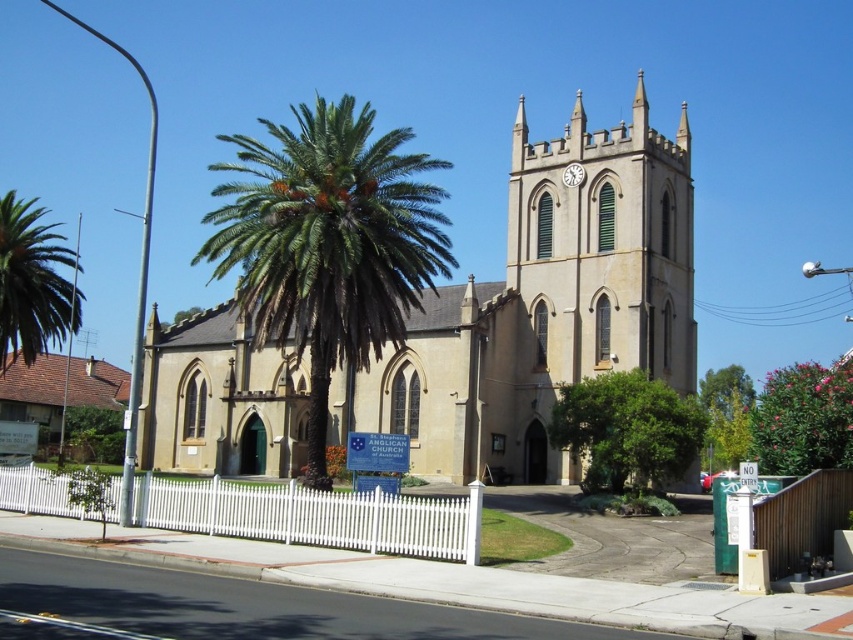
From the picture: You are standing in front of the church and want to place a 10 meter long banner between the beige stone church at center and the green leafy palm tree at center. Will the banner be long enough to stretch between them?

The distance between the beige stone church at center and the green leafy palm tree at center is 12.06 meters. The banner is only 10 meters long, so it will not be long enough to stretch between them.

Consider the image. You are a photographer planning to take a picture of the beige stone church at center and the green leafy tree at center from the front. Which object should you focus on first if you want to capture both in the frame without moving the camera?

The beige stone church at center is larger in size than the green leafy tree at center, so you should focus on the beige stone church at center first to ensure it fits properly in the frame, and then adjust to include the smaller green leafy tree at center.